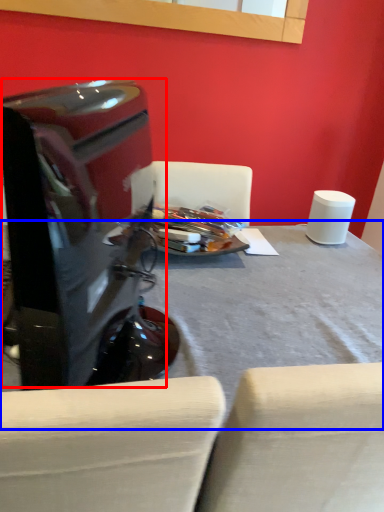
Question: Which of the following is the farthest to the observer, computer monitor (highlighted by a red box) or table (highlighted by a blue box)?

Choices:
 (A) computer monitor
 (B) table

Answer: (B)